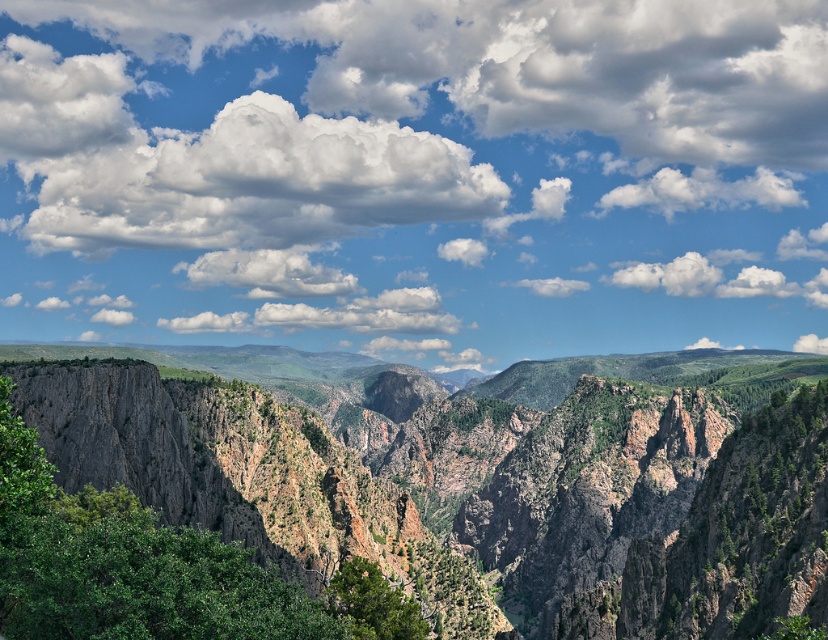
Question: Which object is positioned closest to the white fluffy cloud at upper center?

Choices:
 (A) green textured tree at lower center
 (B) rugged rock canyon at center
 (C) green leafy tree at center

Answer: (B)

Question: Estimate the real-world distances between objects in this image. Which object is closer to the white fluffy cloud at upper center?

Choices:
 (A) green textured tree at lower center
 (B) green leafy tree at center
 (C) rugged rock canyon at center

Answer: (C)

Question: Considering the relative positions of rugged rock canyon at center and green textured tree at lower center in the image provided, where is rugged rock canyon at center located with respect to green textured tree at lower center?

Choices:
 (A) right
 (B) left

Answer: (A)

Question: Which object is the farthest from the green leafy tree at center?

Choices:
 (A) green textured tree at lower center
 (B) rugged rock canyon at center

Answer: (B)

Question: Does white fluffy cloud at upper center appear on the left side of rugged rock canyon at center?

Choices:
 (A) no
 (B) yes

Answer: (B)

Question: Can you confirm if rugged rock canyon at center is positioned to the right of green leafy tree at center?

Choices:
 (A) no
 (B) yes

Answer: (B)